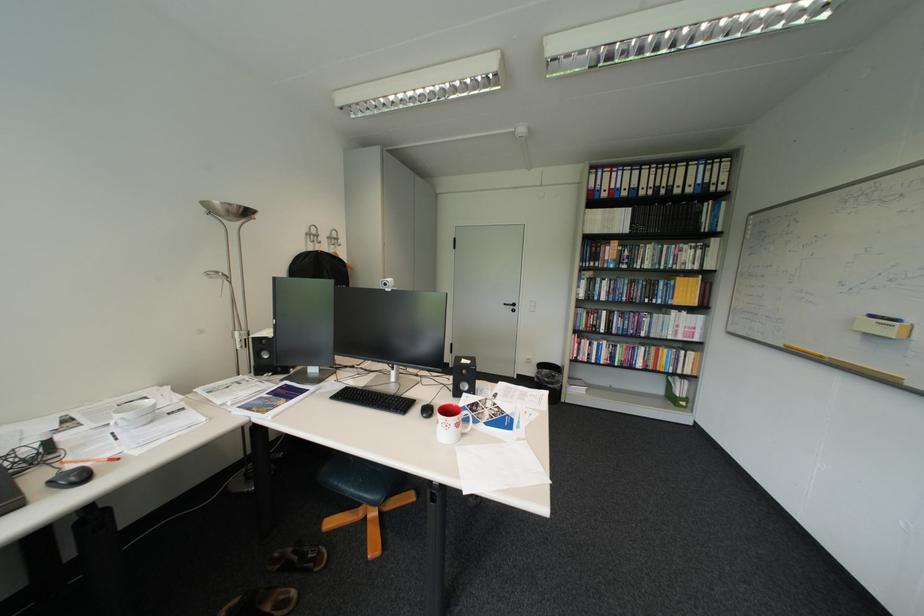
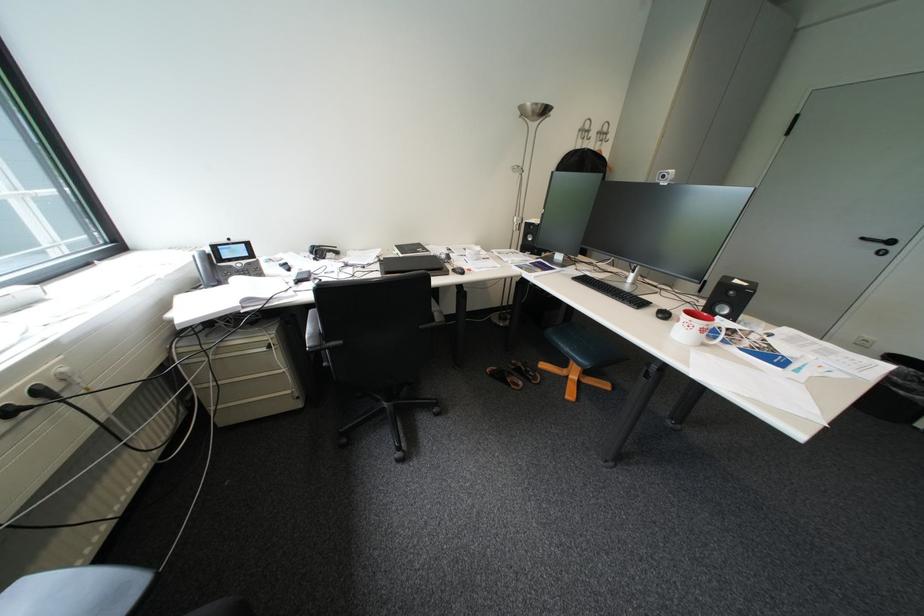
Where in the second image is the point corresponding to the point at 550,367 from the first image?

(895, 358)